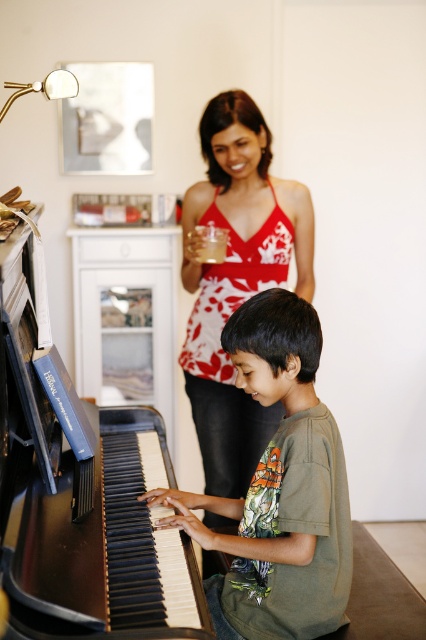
Can you confirm if black polished piano at left is positioned above red floral tank top at center?

No.

Which is more to the left, black polished piano at left or red floral tank top at center?

black polished piano at left is more to the left.

Between point (16, 310) and point (183, 276), which one is positioned behind?

The point (183, 276) is more distant.

The height and width of the screenshot is (640, 426). Identify the location of black polished piano at left. (80, 492).

Which is more to the right, green cotton shirt at center or red floral tank top at center?

From the viewer's perspective, red floral tank top at center appears more on the right side.

Is point (244, 570) more distant than point (261, 173)?

That is False.

Where is `green cotton shirt at center`? The image size is (426, 640). green cotton shirt at center is located at coordinates (279, 488).

Does black polished piano at left appear over green cotton shirt at center?

Correct, black polished piano at left is located above green cotton shirt at center.

Does black polished piano at left have a greater width compared to green cotton shirt at center?

Yes.

Measure the distance between point (132, 490) and camera.

They are 5.26 feet apart.

Locate an element on the screen. Image resolution: width=426 pixels, height=640 pixels. black polished piano at left is located at coordinates (80, 492).